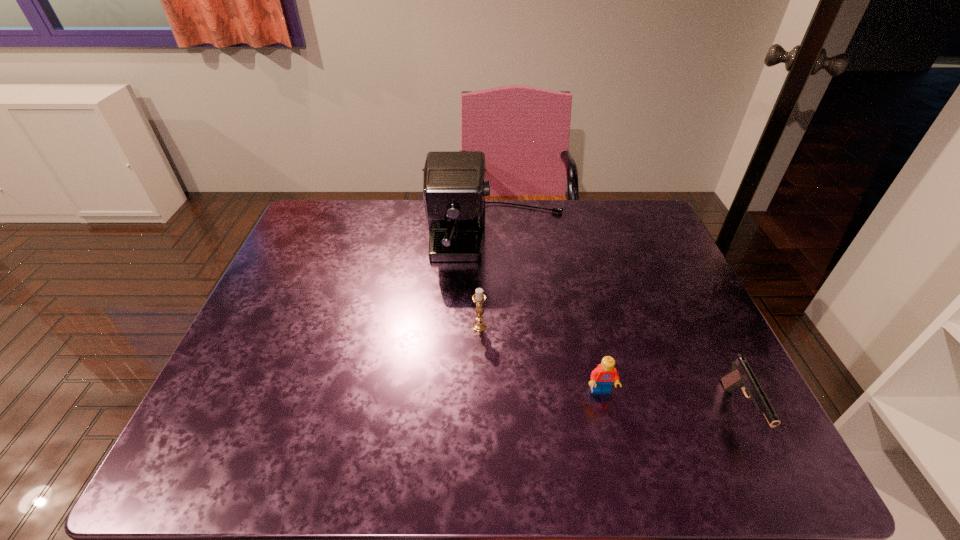
Image resolution: width=960 pixels, height=540 pixels. Identify the location of the tallest object. (454, 186).

At what (x,y) coordinates should I click in order to perform the action: click on the farthest object. Please return your answer as a coordinate pair (x, y). The image size is (960, 540). Looking at the image, I should click on (454, 186).

Locate an element on the screen. This screenshot has height=540, width=960. the third shortest object is located at coordinates (479, 298).

In order to click on candle holder in this screenshot , I will do `click(479, 298)`.

In order to click on Lego in this screenshot , I will do `click(602, 378)`.

The height and width of the screenshot is (540, 960). Identify the location of the rightmost object. (741, 376).

What are the coordinates of `vacant region located on the front-facing side of the coffee maker` in the screenshot? It's located at pos(506,376).

The width and height of the screenshot is (960, 540). Identify the location of vacant region located 0.150m on the left of the third nearest object. (411, 327).

At what (x,y) coordinates should I click in order to perform the action: click on free space located 0.060m on the face of the Lego. Please return your answer as a coordinate pair (x, y). Looking at the image, I should click on click(x=609, y=424).

The image size is (960, 540). What are the coordinates of `free space located at the muzzle of the pistol` in the screenshot? It's located at (770, 473).